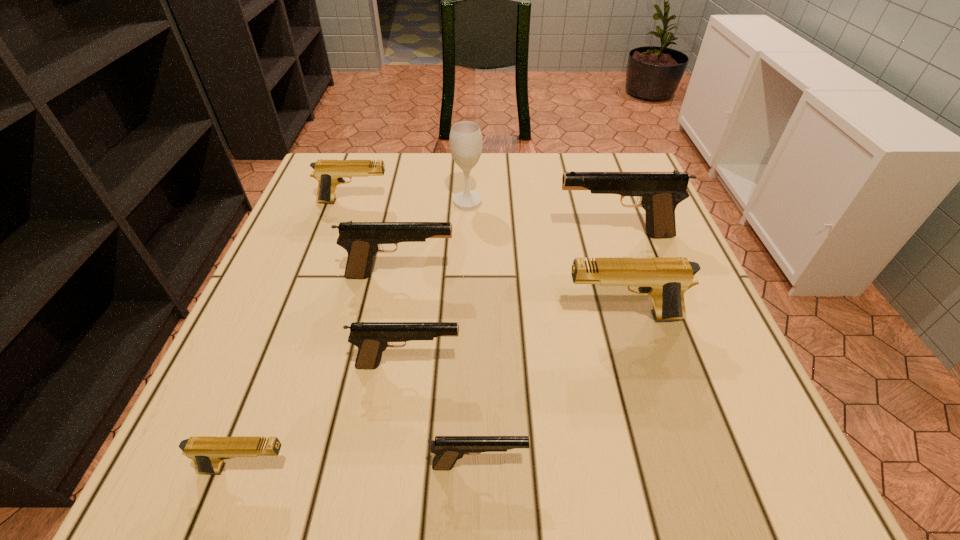
Where is `unoccupied position between the wineglass and the third smallest black pistol`? The image size is (960, 540). unoccupied position between the wineglass and the third smallest black pistol is located at coordinates (434, 238).

Find the location of a particular element. The height and width of the screenshot is (540, 960). free space between the smallest tan pistol and the second biggest tan pistol is located at coordinates (300, 335).

Where is `free space between the farthest black pistol and the tallest object`? The image size is (960, 540). free space between the farthest black pistol and the tallest object is located at coordinates (540, 218).

I want to click on blank region between the tallest object and the fifth nearest pistol, so click(434, 238).

You are a GUI agent. You are given a task and a screenshot of the screen. Output one action in this format:
    pyautogui.click(x=<x>, y=<y>)
    Task: Click on the closest object to the second farthest black pistol
    The image size is (960, 540).
    Given the screenshot: What is the action you would take?
    pyautogui.click(x=372, y=338)

What are the coordinates of `object that stands as the sixth closest to the second biggest tan pistol` in the screenshot? It's located at (208, 453).

Point out which pistol is positioned as the third nearest to the nearest black pistol. Please provide its 2D coordinates. Your answer should be formatted as a tuple, i.e. [(x, y)], where the tuple contains the x and y coordinates of a point satisfying the conditions above.

[(666, 280)]

Locate an element on the screen. pistol that is the fifth closest to the tallest object is located at coordinates (372, 338).

Identify the location of black pistol that stands as the closest to the second smallest tan pistol. The image size is (960, 540). (362, 240).

Locate an element on the screen. Image resolution: width=960 pixels, height=540 pixels. black pistol that can be found as the closest to the nearest tan pistol is located at coordinates (372, 338).